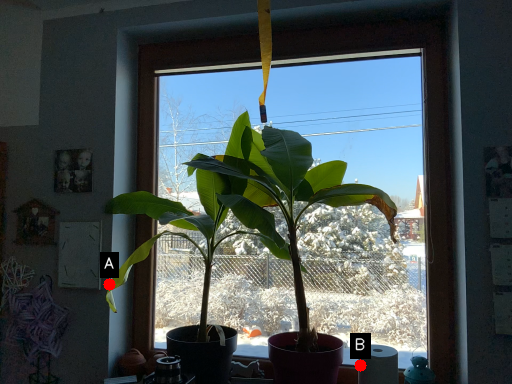
Question: Two points are circled on the image, labeled by A and B beside each circle. Among these points, which one is nearest to the camera?

Choices:
 (A) A is closer
 (B) B is closer

Answer: (B)